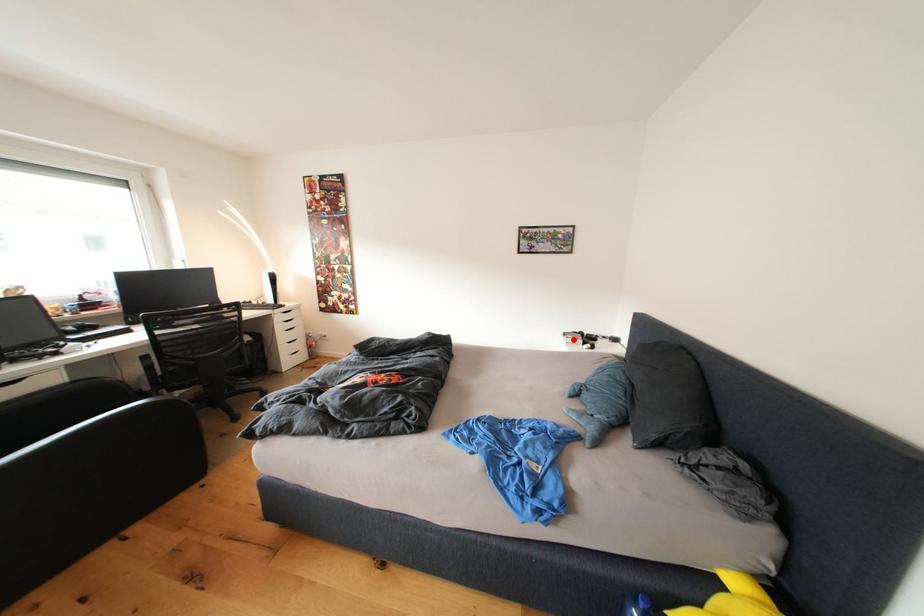
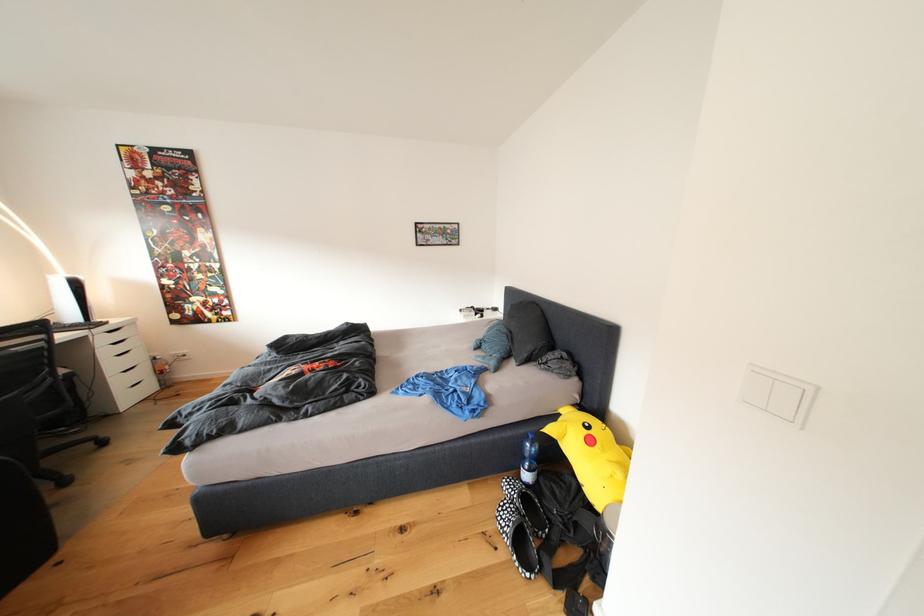
The point at the highlighted location is marked in the first image. Where is the corresponding point in the second image?

(469, 315)